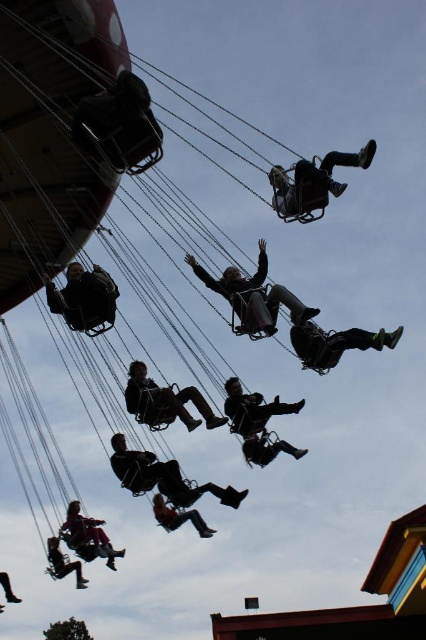
Question: In this image, where is matte black jacket at center located relative to silhouette leather jacket at center?

Choices:
 (A) left
 (B) right

Answer: (B)

Question: Is dark gray fabric swing at center to the left of matte black jacket at lower left from the viewer's perspective?

Choices:
 (A) no
 (B) yes

Answer: (A)

Question: Considering the real-world distances, which object is closest to the dark gray fabric swing at center?

Choices:
 (A) dark gray fabric swing at left
 (B) matte black person at lower left
 (C) matte black jacket at lower left
 (D) dark gray fabric swing at lower right

Answer: (D)

Question: Based on their relative distances, which object is farther from the orange fabric swing at center?

Choices:
 (A) matte black swing at center
 (B) matte black pants at center

Answer: (B)

Question: Does silhouette leather jacket at center have a lesser width compared to matte black jacket at lower left?

Choices:
 (A) no
 (B) yes

Answer: (A)

Question: Among these points, which one is nearest to the camera?

Choices:
 (A) (74, 272)
 (B) (307, 339)
 (C) (247, 454)

Answer: (A)